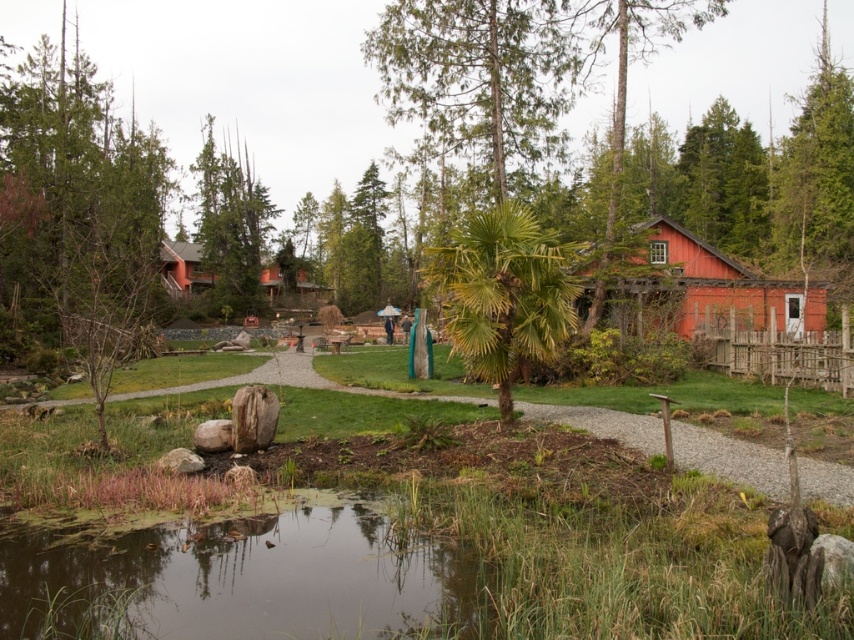
Which of these two, green leafy palm tree at center or red wooden hut at center, stands taller?

red wooden hut at center

Looking at this image, can you confirm if green leafy palm tree at center is positioned below red wooden hut at center?

Yes.

Does point (496, 368) come closer to viewer compared to point (687, 292)?

That is True.

I want to click on green leafy palm tree at center, so click(506, 292).

The width and height of the screenshot is (854, 640). I want to click on green grassy pond at lower center, so click(x=246, y=579).

Does green grassy pond at lower center have a smaller size compared to green leafy palm tree at center?

No, green grassy pond at lower center is not smaller than green leafy palm tree at center.

Who is more distant from viewer, [284,564] or [483,353]?

Positioned behind is point [483,353].

I want to click on green grassy pond at lower center, so click(x=246, y=579).

Does green leafy palm tree at center appear over green textured tree at upper left?

Incorrect, green leafy palm tree at center is not positioned above green textured tree at upper left.

Based on the photo, who is positioned more to the right, green leafy palm tree at center or green textured tree at upper left?

Positioned to the right is green leafy palm tree at center.

At what (x,y) coordinates should I click in order to perform the action: click on green leafy palm tree at center. Please return your answer as a coordinate pair (x, y). This screenshot has height=640, width=854. Looking at the image, I should click on (506, 292).